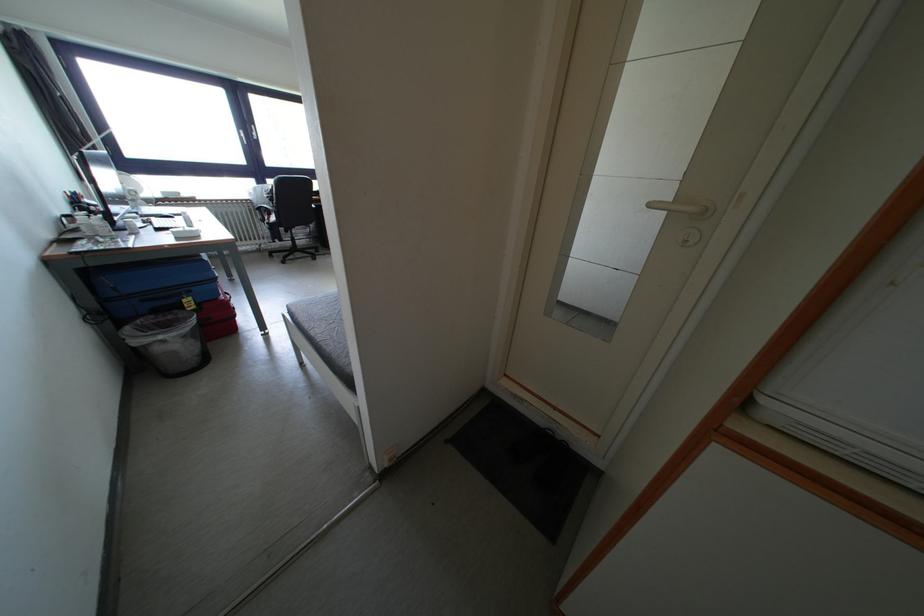
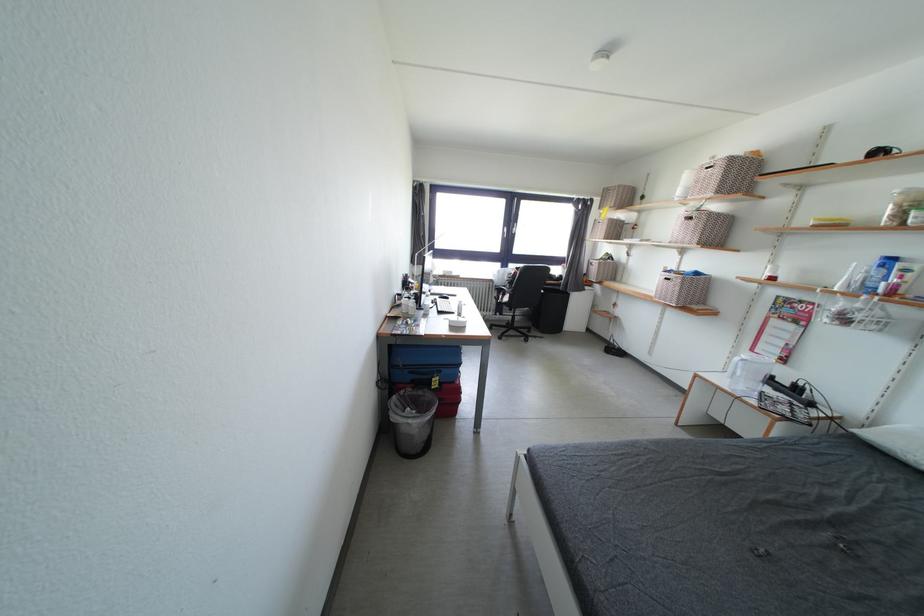
Where in the second image is the point corresponding to (272,187) from the first image?

(514, 270)